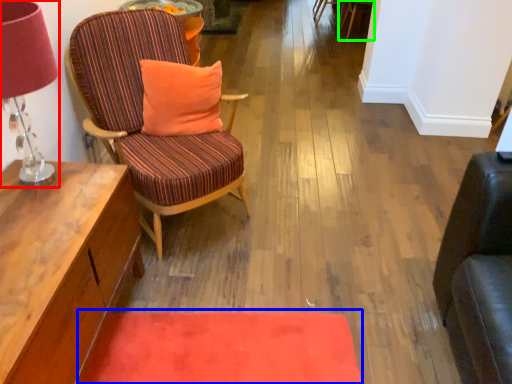
Question: Considering the real-world distances, which object is farthest from table lamp (highlighted by a red box)? mat (highlighted by a blue box) or chair (highlighted by a green box)?

Choices:
 (A) mat
 (B) chair

Answer: (B)